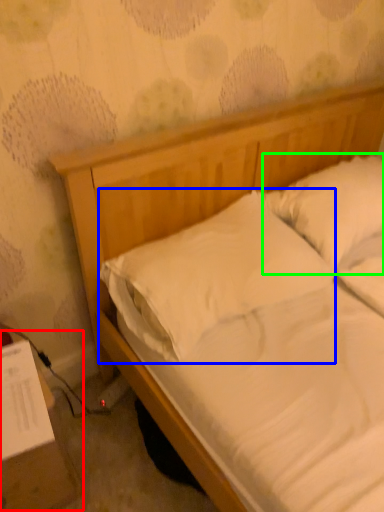
Question: Which object is positioned closest to table (highlighted by a red box)? Select from pillow (highlighted by a blue box) and pillow (highlighted by a green box).

Choices:
 (A) pillow
 (B) pillow

Answer: (A)